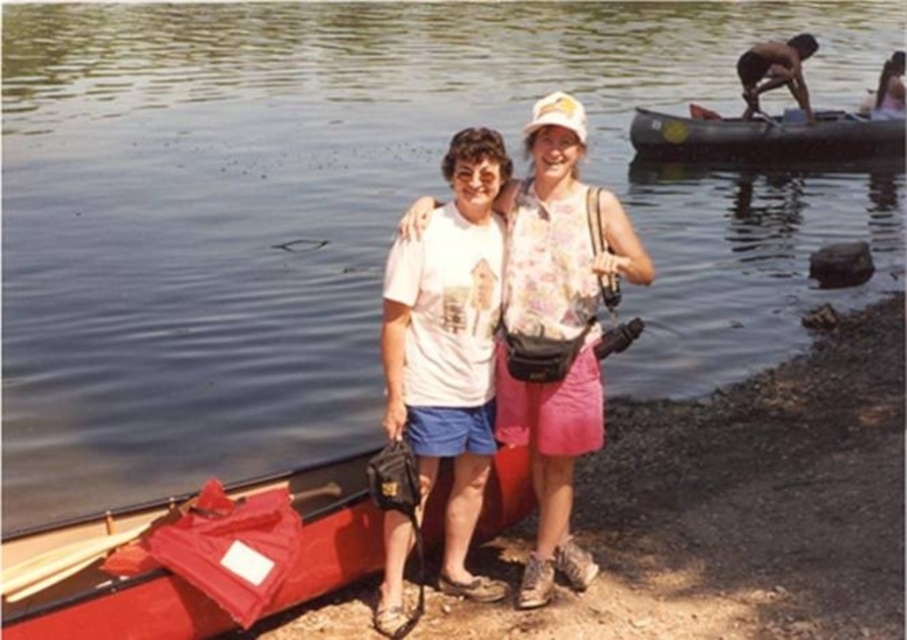
Does rubberized black canoe at right appear under wooden paddle at lower left?

Incorrect, rubberized black canoe at right is not positioned below wooden paddle at lower left.

Which is behind, point (680, 118) or point (70, 547)?

Point (680, 118)

The image size is (907, 640). I want to click on rubberized black canoe at right, so click(x=763, y=136).

Who is lower down, white cotton shirt at center or skinny man at upper right?

Positioned lower is white cotton shirt at center.

This screenshot has width=907, height=640. Identify the location of white cotton shirt at center. (557, 324).

The image size is (907, 640). Identify the location of white cotton shirt at center. (557, 324).

Based on the photo, who is higher up, white cotton shirt at center or rubberized black canoe at right?

rubberized black canoe at right is above.

Consider the image. Does white cotton shirt at center appear on the right side of rubberized black canoe at right?

In fact, white cotton shirt at center is to the left of rubberized black canoe at right.

Is point (587, 436) positioned before point (740, 150)?

Yes, point (587, 436) is closer to viewer.

You are a GUI agent. You are given a task and a screenshot of the screen. Output one action in this format:
    pyautogui.click(x=<x>, y=<y>)
    Task: Click on the white cotton shirt at center
    The width and height of the screenshot is (907, 640).
    Given the screenshot: What is the action you would take?
    pyautogui.click(x=557, y=324)